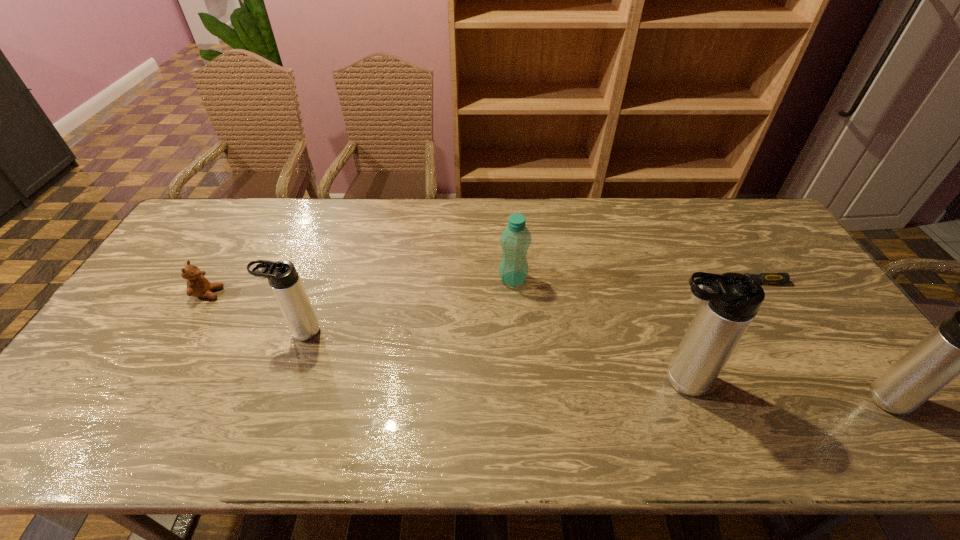
Where is `the fourth farthest object`? the fourth farthest object is located at coordinates (283, 278).

Find the location of a particular element. The image size is (960, 540). the farthest thermos bottle is located at coordinates point(283,278).

The width and height of the screenshot is (960, 540). What are the coordinates of `the fourth object from left to right` in the screenshot? It's located at (729, 302).

You are a GUI agent. You are given a task and a screenshot of the screen. Output one action in this format:
    pyautogui.click(x=<x>, y=<y>)
    Task: Click on the second tallest thermos bottle
    Image resolution: width=960 pixels, height=540 pixels.
    Given the screenshot: What is the action you would take?
    pyautogui.click(x=959, y=345)

Locate an element on the screen. the rightmost thermos bottle is located at coordinates (959, 345).

Identify the location of the fourth object from right to left. (515, 240).

This screenshot has height=540, width=960. In order to click on the shortest object in this screenshot , I will do `click(766, 278)`.

This screenshot has height=540, width=960. Find the location of `the second object from right to left`. the second object from right to left is located at coordinates (766, 278).

The image size is (960, 540). I want to click on teddy bear, so click(197, 285).

Image resolution: width=960 pixels, height=540 pixels. In order to click on the fifth tallest object in this screenshot , I will do click(x=197, y=285).